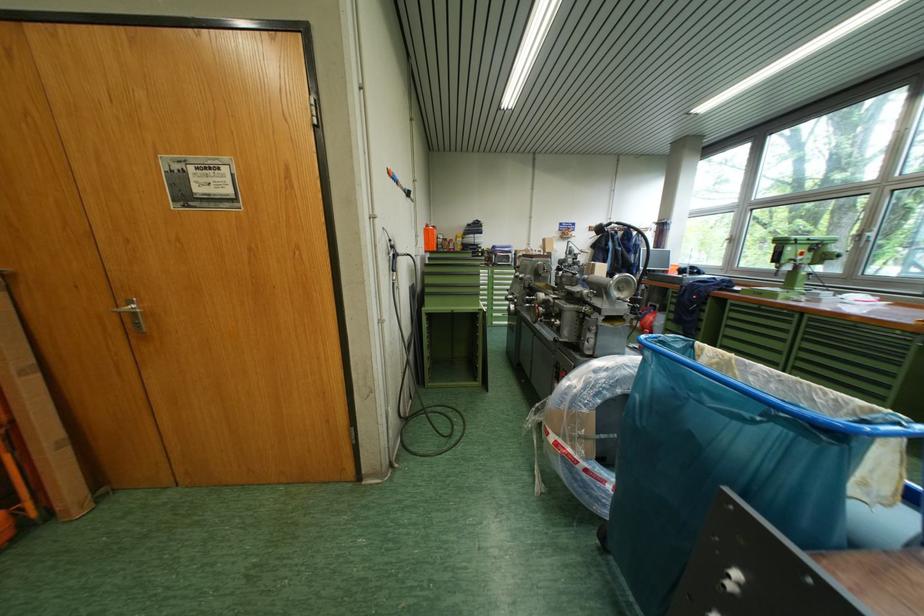
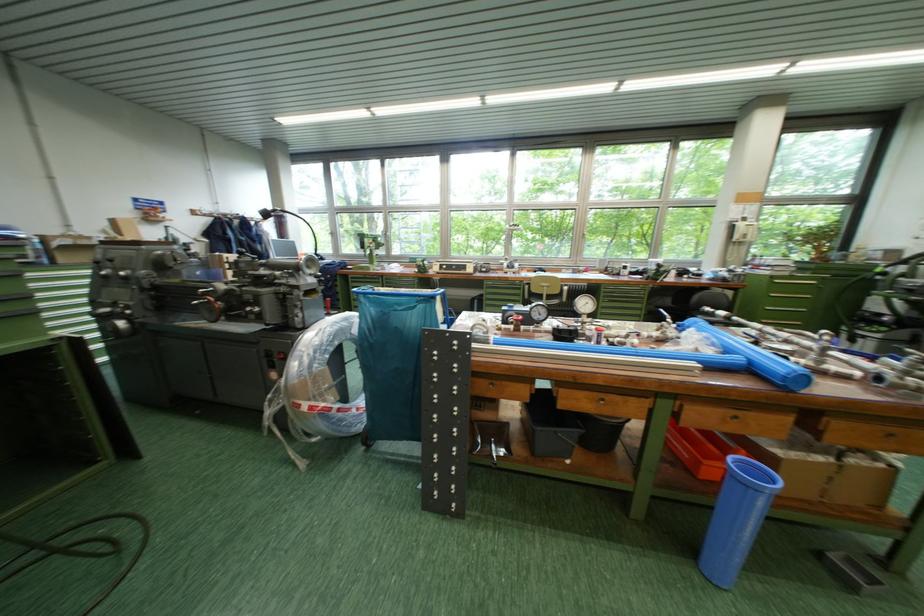
Question: The first image is from the beginning of the video and the second image is from the end. How did the camera likely rotate when shooting the video?

Choices:
 (A) Left
 (B) Right
 (C) Up
 (D) Down

Answer: (B)